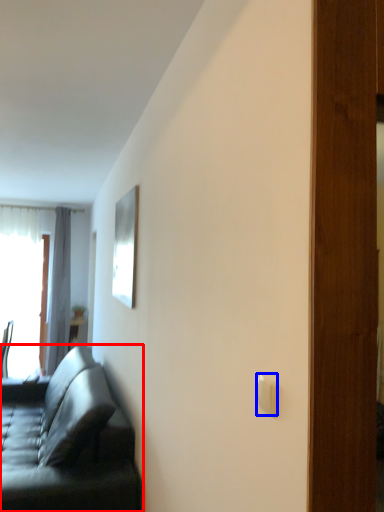
Question: Which object is closer to the camera taking this photo, studio couch (highlighted by a red box) or light switch (highlighted by a blue box)?

Choices:
 (A) studio couch
 (B) light switch

Answer: (B)